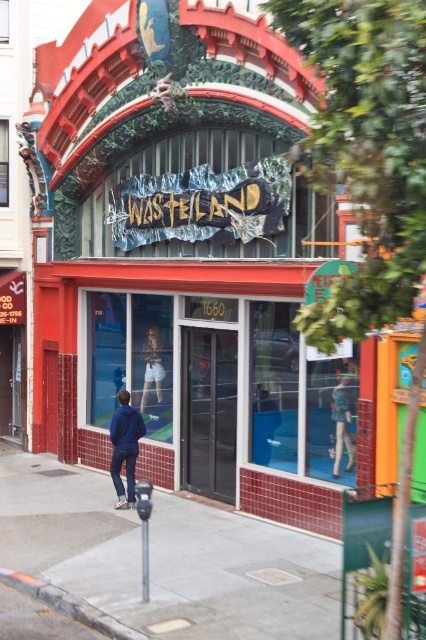
Question: Can you confirm if matte white shorts at center is thinner than metallic parking meter at lower center?

Choices:
 (A) yes
 (B) no

Answer: (B)

Question: Observing the image, what is the correct spatial positioning of gray concrete curb at lower left in reference to matte white shorts at center?

Choices:
 (A) above
 (B) below

Answer: (B)

Question: Considering the real-world distances, which object is closest to the metallic pole at lower center?

Choices:
 (A) gray concrete curb at lower left
 (B) matte white shorts at center
 (C) metallic parking meter at lower center
 (D) light blue denim shorts at center

Answer: (C)

Question: Which point is farther to the camera?

Choices:
 (A) blue denim jacket at lower left
 (B) metallic parking meter at lower center
 (C) gray concrete sidewalk at lower left

Answer: (A)

Question: Is gray concrete sidewalk at lower left positioned at the back of blue denim jacket at lower left?

Choices:
 (A) no
 (B) yes

Answer: (A)

Question: Which of the following is the farthest from the observer?

Choices:
 (A) gray concrete curb at lower left
 (B) gray concrete sidewalk at lower left
 (C) metallic parking meter at lower center

Answer: (C)